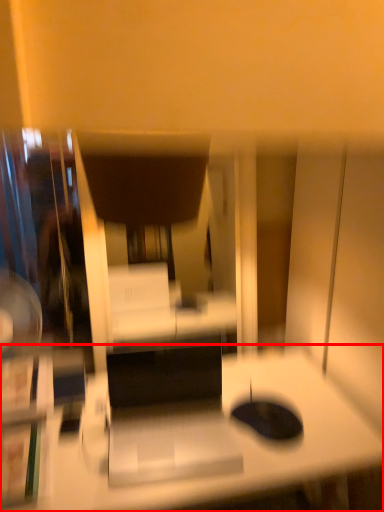
Question: From the image's perspective, considering the relative positions of desk (annotated by the red box) and swivel chair in the image provided, where is desk (annotated by the red box) located with respect to the staircase?

Choices:
 (A) above
 (B) below

Answer: (B)